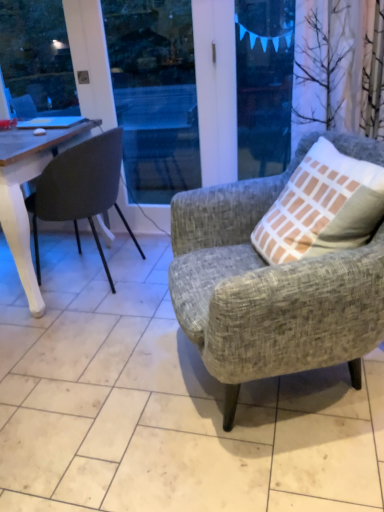
Question: Does point (258, 322) appear closer or farther from the camera than point (104, 185)?

Choices:
 (A) closer
 (B) farther

Answer: (A)

Question: Which is correct: textured gray armchair at right, acting as the 1th chair starting from the right, is inside matte black chair at left, arranged as the second chair when viewed from the front, or outside of it?

Choices:
 (A) inside
 (B) outside

Answer: (B)

Question: Which is nearer to the matte black chair at left, positioned as the 2th chair in right-to-left order?

Choices:
 (A) textured gray armchair at right, which appears as the first chair when viewed from the front
 (B) transparent plastic window screen at upper center

Answer: (A)

Question: Which is farther from the transparent plastic window screen at upper center?

Choices:
 (A) matte black chair at left, the 1th chair when ordered from back to front
 (B) textured gray armchair at right, which appears as the first chair when viewed from the front

Answer: (B)